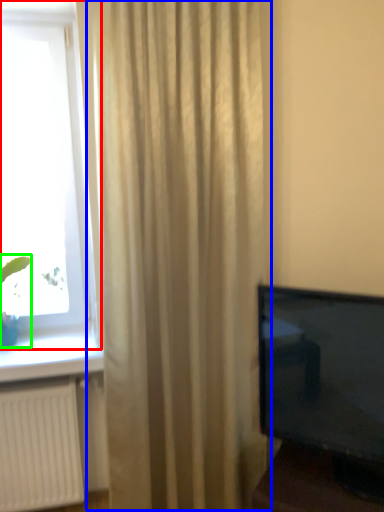
Question: Which is nearer to the window (highlighted by a red box)? curtain (highlighted by a blue box) or plant (highlighted by a green box).

Choices:
 (A) curtain
 (B) plant

Answer: (A)